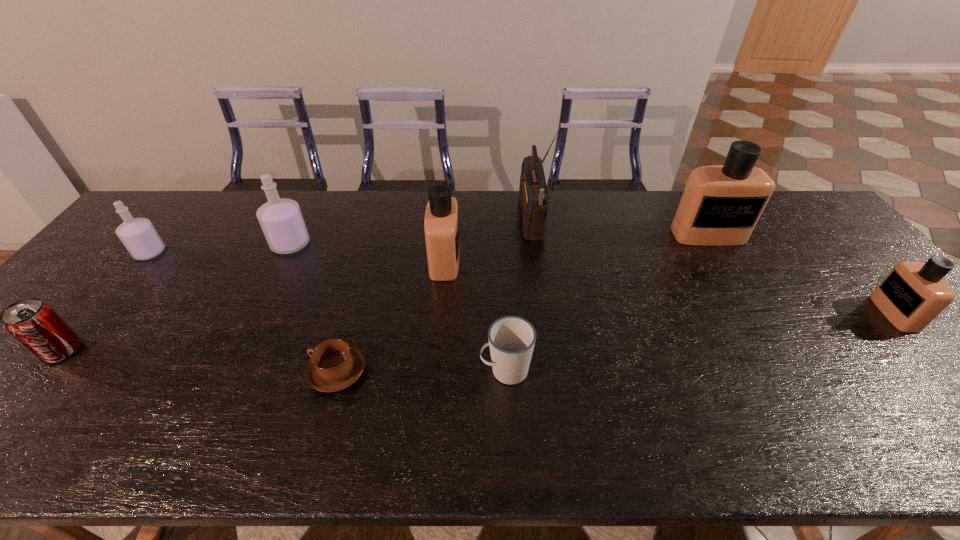
Where is `blank space at the right edge`? The width and height of the screenshot is (960, 540). blank space at the right edge is located at coordinates (920, 395).

Find the location of a particular element. The width and height of the screenshot is (960, 540). vacant space at the far left corner of the desktop is located at coordinates (171, 214).

In order to click on free spot between the red pop soda and the leftmost beige perfume in this screenshot , I will do `click(253, 306)`.

You are a GUI agent. You are given a task and a screenshot of the screen. Output one action in this format:
    pyautogui.click(x=<x>, y=<y>)
    Task: Click on the free spot between the tallest object and the bigger purple perfume
    The width and height of the screenshot is (960, 540).
    Given the screenshot: What is the action you would take?
    pyautogui.click(x=411, y=231)

Where is `vacant space in between the shortest object and the pop soda`? vacant space in between the shortest object and the pop soda is located at coordinates (200, 361).

Locate an element on the screen. unoccupied area between the nearest perfume and the tallest object is located at coordinates (712, 265).

Where is `vacant area that lies between the radio receiver and the fourth nearest object`? This screenshot has height=540, width=960. vacant area that lies between the radio receiver and the fourth nearest object is located at coordinates (712, 265).

You are a GUI agent. You are given a task and a screenshot of the screen. Output one action in this format:
    pyautogui.click(x=<x>, y=<y>)
    Task: Click on the vacant area between the pop soda and the fifth object from right to left
    Image resolution: width=960 pixels, height=540 pixels.
    Given the screenshot: What is the action you would take?
    pyautogui.click(x=253, y=306)

The image size is (960, 540). Identify the location of free point between the fourth object from right to left and the bigger purple perfume. (x=398, y=307).

Image resolution: width=960 pixels, height=540 pixels. Find the location of `unoccupied area between the tallest object and the fourth object from right to left`. unoccupied area between the tallest object and the fourth object from right to left is located at coordinates (518, 294).